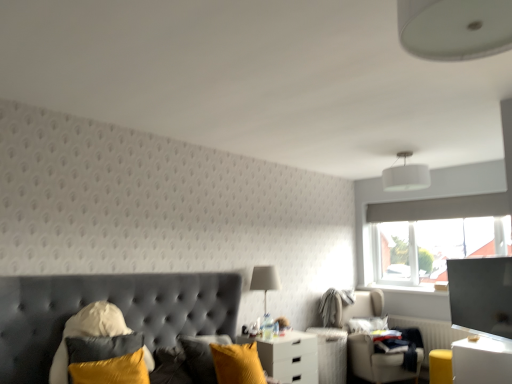
Question: Is white glossy nightstand at center, the second nightstand viewed from the front, bigger or smaller than matte white table lamp at center?

Choices:
 (A) big
 (B) small

Answer: (A)

Question: In terms of height, does white glossy nightstand at center, which is the first nightstand in back-to-front order, look taller or shorter compared to matte white table lamp at center?

Choices:
 (A) tall
 (B) short

Answer: (B)

Question: Based on their relative distances, which object is nearer to the velvet yellow pillow at lower left, the 2th pillow in the back-to-front sequence?

Choices:
 (A) white fabric lampshade at upper center
 (B) white glossy nightstand at lower right, which is counted as the 1th nightstand, starting from the front
 (C) soft white pillow at lower right, the first pillow from the bottom
 (D) white glossy nightstand at center, the second nightstand viewed from the front
 (E) beige fabric swivel chair at lower right

Answer: (D)

Question: Which object is the closest to the white glossy nightstand at center, which is counted as the 2th nightstand, starting from the right?

Choices:
 (A) white fabric lampshade at upper center
 (B) beige fabric swivel chair at lower right
 (C) white glossy nightstand at lower right, the 1th nightstand positioned from the right
 (D) matte white table lamp at center
 (E) velvet yellow pillow at lower left, positioned as the first pillow in top-to-bottom order

Answer: (D)